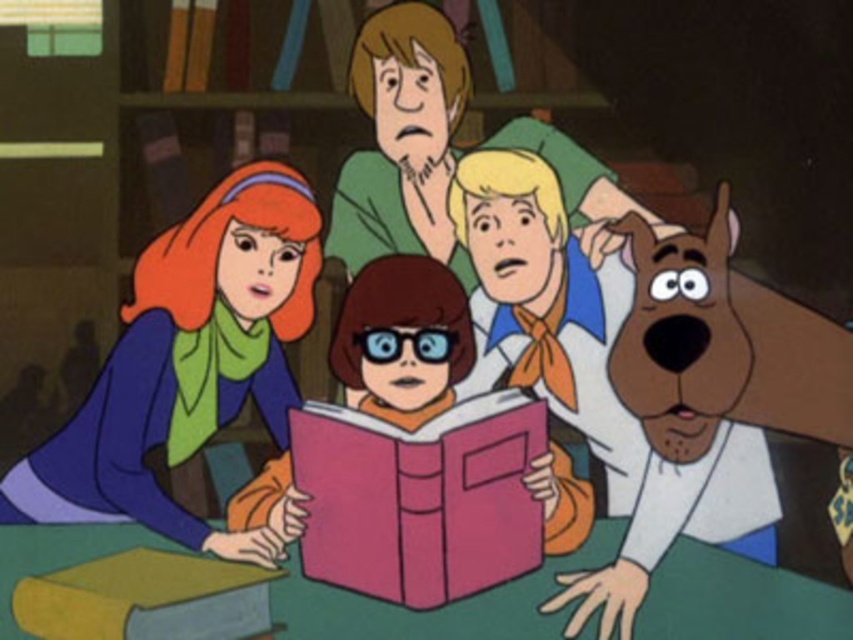
Who is lower down, pink matte book at center or yellow matte book at lower left?

yellow matte book at lower left

Is pink matte book at center bigger than yellow matte book at lower left?

Indeed, pink matte book at center has a larger size compared to yellow matte book at lower left.

Does point (439, 540) come farther from viewer compared to point (61, 598)?

Yes.

Locate an element on the screen. pink matte book at center is located at coordinates (421, 499).

Who is higher up, matte green sweater at left or pink matte book at center?

Positioned higher is matte green sweater at left.

Does point (7, 509) come closer to viewer compared to point (461, 524)?

Yes, point (7, 509) is in front of point (461, 524).

The width and height of the screenshot is (853, 640). Find the location of `matte green sweater at left`. matte green sweater at left is located at coordinates (187, 364).

Does matte green sweater at left have a smaller size compared to yellow matte book at lower left?

No, matte green sweater at left is not smaller than yellow matte book at lower left.

Which is behind, point (157, 364) or point (99, 600)?

Point (157, 364)

Between point (252, 532) and point (206, 566), which one is positioned behind?

The point (252, 532) is behind.

I want to click on matte green sweater at left, so click(x=187, y=364).